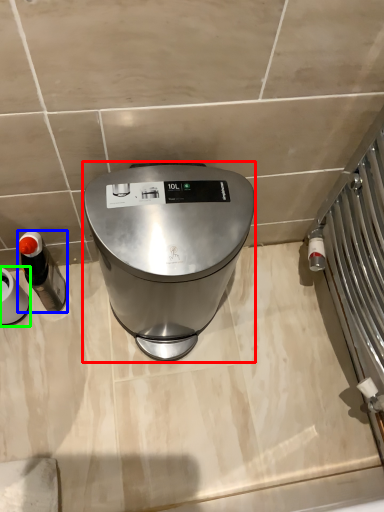
Question: Based on their relative distances, which object is farther from home appliance (highlighted by a red box)? Choose from appliance (highlighted by a blue box) and appliance (highlighted by a green box).

Choices:
 (A) appliance
 (B) appliance

Answer: (B)